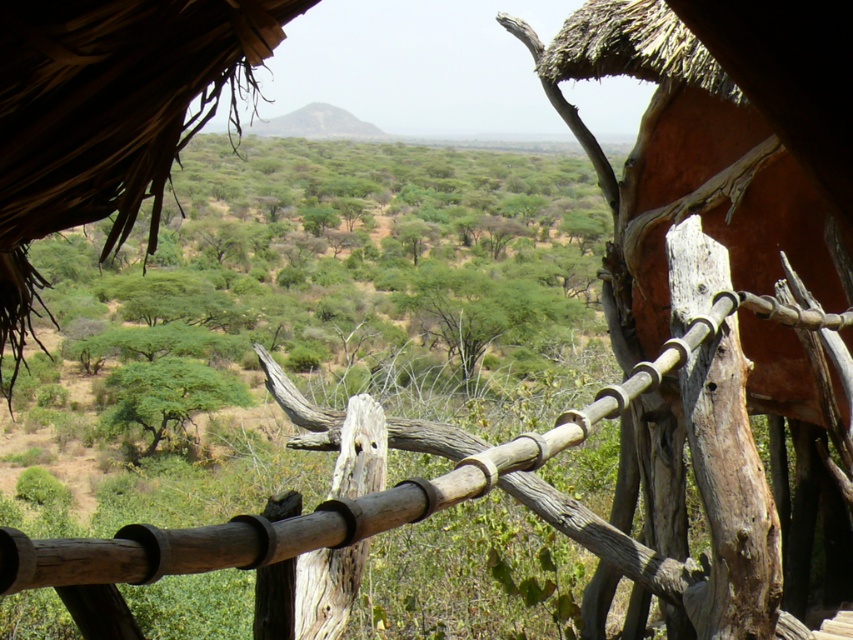
Which of these two, brown wooden fence at center or green leafy tree at center, stands taller?

brown wooden fence at center

Can you confirm if brown wooden fence at center is positioned to the right of green leafy tree at center?

Correct, you'll find brown wooden fence at center to the right of green leafy tree at center.

At what (x,y) coordinates should I click in order to perform the action: click on brown wooden fence at center. Please return your answer as a coordinate pair (x, y). This screenshot has width=853, height=640. Looking at the image, I should click on (367, 493).

Identify the location of brown wooden fence at center. The height and width of the screenshot is (640, 853). (367, 493).